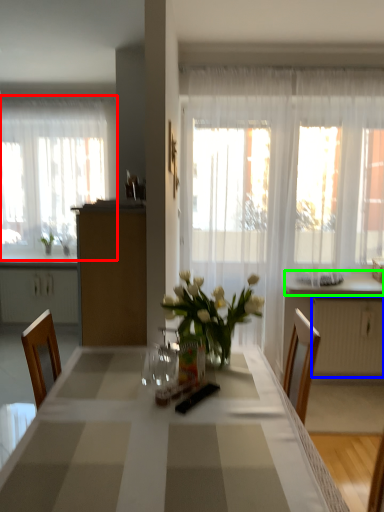
Question: Based on their relative distances, which object is farther from curtain (highlighted by a red box)? Choose from radiator (highlighted by a blue box) and counter top (highlighted by a green box).

Choices:
 (A) radiator
 (B) counter top

Answer: (A)